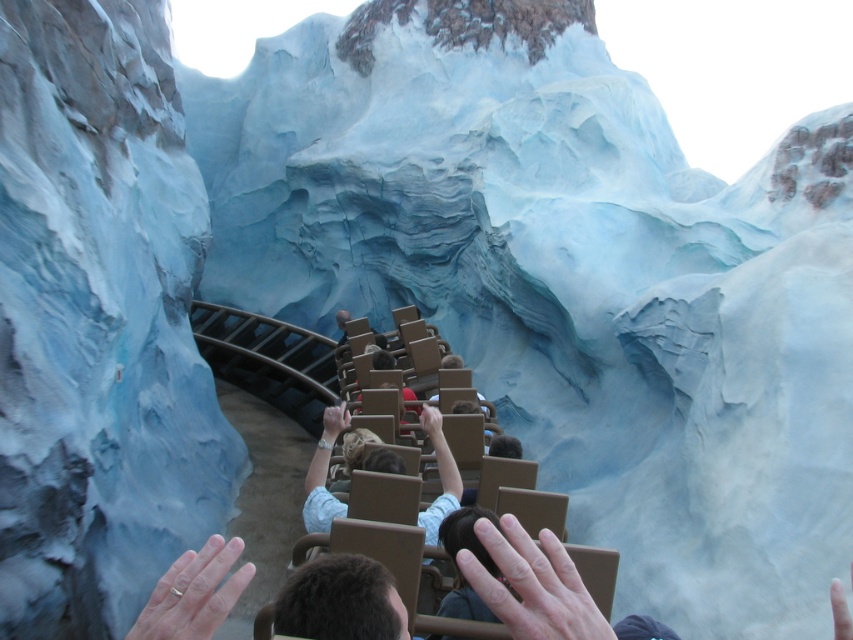
Consider the image. Who is shorter, brown wooden escalator at center or dark brown hair at center?

dark brown hair at center

Between point (297, 388) and point (354, 604), which one is positioned behind?

The point (297, 388) is behind.

Between point (280, 349) and point (282, 598), which one is positioned behind?

The point (280, 349) is behind.

Find the location of a particular element. This screenshot has height=640, width=853. brown wooden escalator at center is located at coordinates pyautogui.click(x=268, y=358).

Can you confirm if dark brown hair at center is positioned below light brown leather jacket at center?

Yes, dark brown hair at center is below light brown leather jacket at center.

Who is more distant from viewer, (328, 572) or (390, 461)?

The point (390, 461) is behind.

Find the location of a particular element. This screenshot has height=640, width=853. dark brown hair at center is located at coordinates (340, 600).

Can you confirm if smooth skin hand at center is shorter than dark brown hair at center?

In fact, smooth skin hand at center may be taller than dark brown hair at center.

Which of these two, smooth skin hand at center or dark brown hair at center, stands taller?

Standing taller between the two is smooth skin hand at center.

Identify the location of smooth skin hand at center. (532, 584).